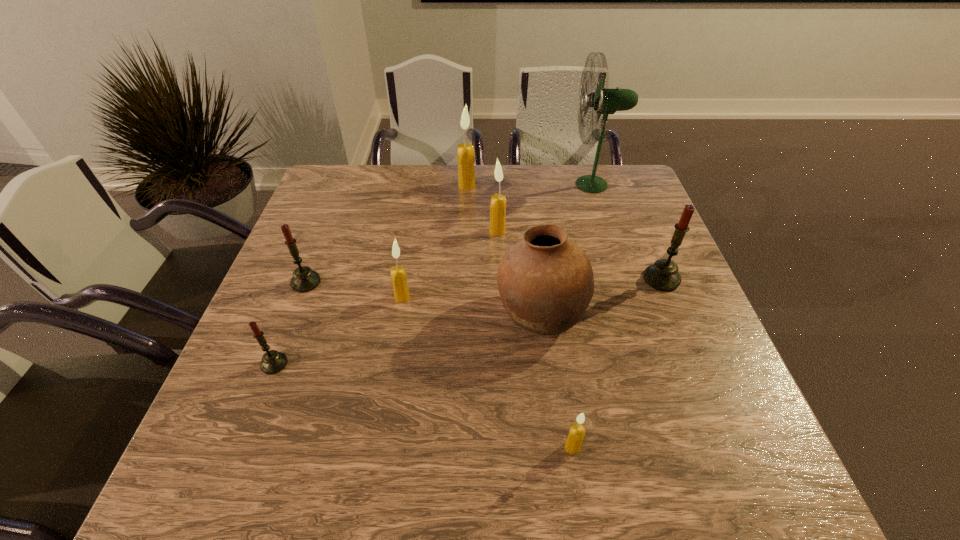
Where is `the tallest object`? The width and height of the screenshot is (960, 540). the tallest object is located at coordinates (605, 101).

Where is `green fan`? green fan is located at coordinates (605, 101).

Identify the location of the farthest candle. The width and height of the screenshot is (960, 540). (465, 152).

The image size is (960, 540). What are the coordinates of `the second tallest object` in the screenshot? It's located at (465, 152).

At what (x,y) coordinates should I click in order to perform the action: click on the rightmost red candle. Please return your answer as a coordinate pair (x, y). The image size is (960, 540). Looking at the image, I should click on (663, 275).

In order to click on the rightmost candle in this screenshot , I will do [x=663, y=275].

The width and height of the screenshot is (960, 540). I want to click on the second farthest cream candle, so click(x=498, y=201).

Where is `the second farthest candle`? Image resolution: width=960 pixels, height=540 pixels. the second farthest candle is located at coordinates (498, 201).

The width and height of the screenshot is (960, 540). Find the location of `pottery`. pottery is located at coordinates (546, 283).

Identify the location of the second smallest red candle. This screenshot has width=960, height=540. (304, 279).